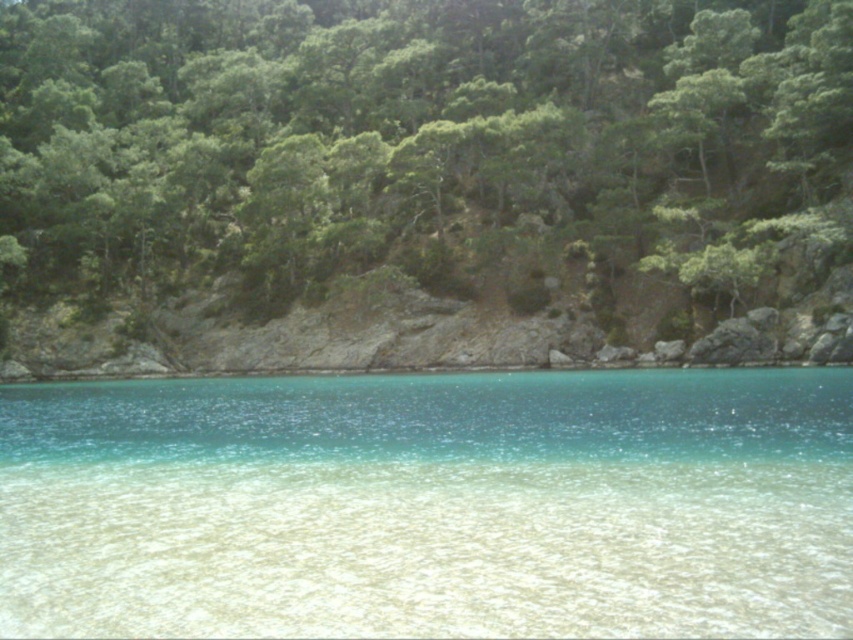
You are a hiker standing at the clear sand at lower center and want to reach the green leafy trees at upper center. Which direction should you move to get there?

You should move upward to reach the green leafy trees at upper center from the clear sand at lower center because the green leafy trees at upper center is taller than clear sand at lower center.

You are standing on the beach and want to walk towards the clear sand at lower center. Which direction should you move relative to the green leafy trees at upper center?

You should move away from the green leafy trees at upper center to reach the clear sand at lower center because the clear sand is located behind the trees.

You are a hiker who wants to reach the clear sand at lower center from your current position near the green leafy trees at upper center. The path you plan to take is straight. Given that your maximum comfortable walking distance in a straight line is 50 meters, will you be able to reach the destination without feeling exhausted?

The distance between the green leafy trees at upper center and the clear sand at lower center is 50.81 meters, which exceeds your maximum comfortable walking distance of 50 meters. Therefore, you may feel exhausted before reaching the destination.